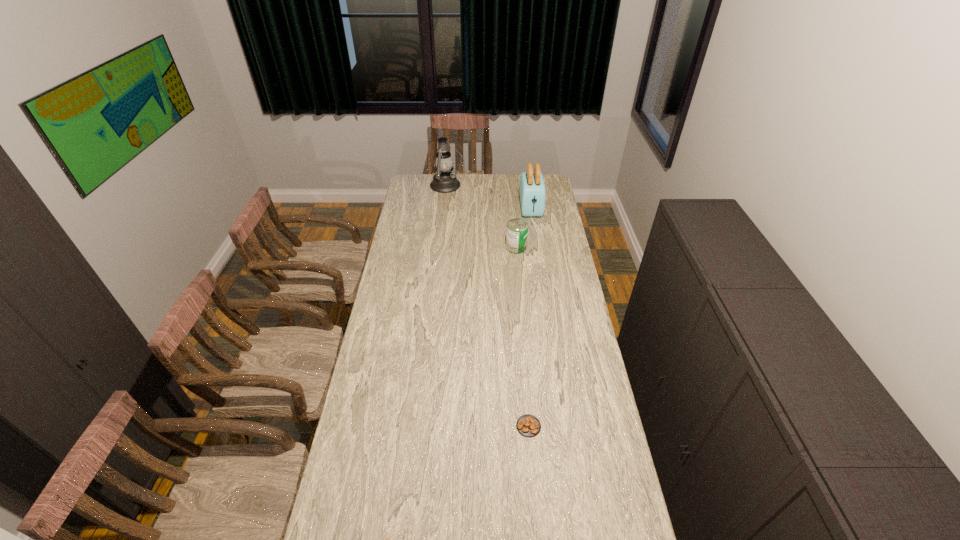
Where is `free space located 0.150m on the back of the third tallest object`? Image resolution: width=960 pixels, height=540 pixels. free space located 0.150m on the back of the third tallest object is located at coordinates (514, 225).

This screenshot has width=960, height=540. I want to click on vacant space located 0.370m on the left of the farther pastry, so click(x=410, y=426).

In order to click on object present at the far edge in this screenshot , I will do `click(444, 181)`.

The width and height of the screenshot is (960, 540). Find the location of `object that is at the left edge`. object that is at the left edge is located at coordinates (444, 181).

Identify the location of object present at the right edge. (532, 192).

Identify the location of object present at the far left corner. (444, 181).

Where is `vacant space at the far edge of the desktop`? Image resolution: width=960 pixels, height=540 pixels. vacant space at the far edge of the desktop is located at coordinates (504, 174).

In the image, there is a desktop. Identify the location of vacant region at the left edge. Image resolution: width=960 pixels, height=540 pixels. [x=358, y=445].

Find the location of a particular element. This screenshot has height=540, width=960. free spot at the right edge of the desktop is located at coordinates (536, 242).

This screenshot has width=960, height=540. I want to click on vacant space at the far left corner of the desktop, so (x=432, y=177).